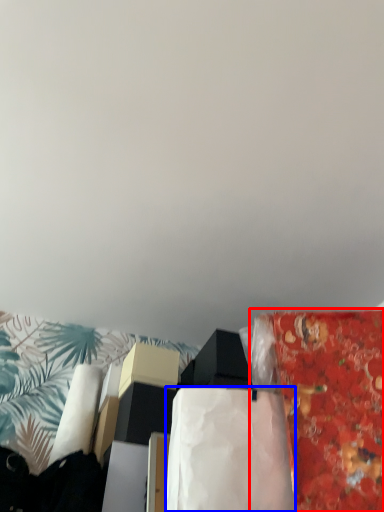
Question: Among these objects, which one is farthest to the camera, material (highlighted by a red box) or blanket (highlighted by a blue box)?

Choices:
 (A) material
 (B) blanket

Answer: (B)